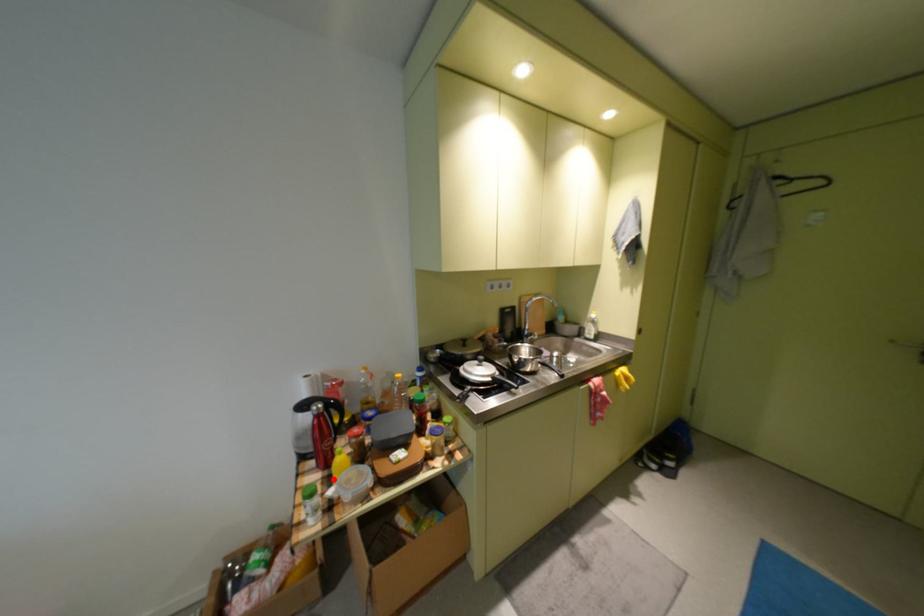
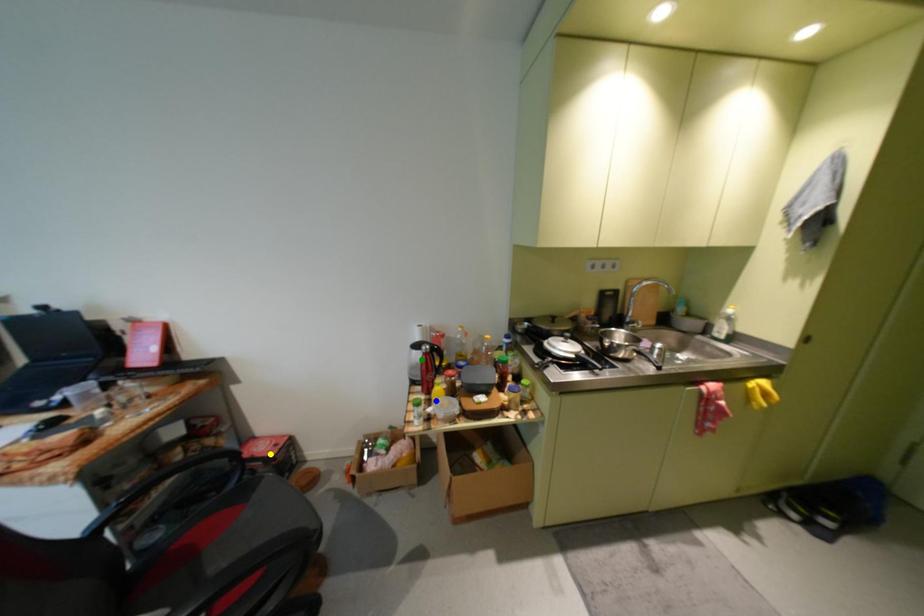
Question: I am providing you with two images of the same scene from different viewpoints. A red point is marked on the first image. You are given multiple points on the second image. Which point in image 2 is actually the same real-world point as the red point in image 1?

Choices:
 (A) blue point
 (B) yellow point
 (C) green point

Answer: (A)